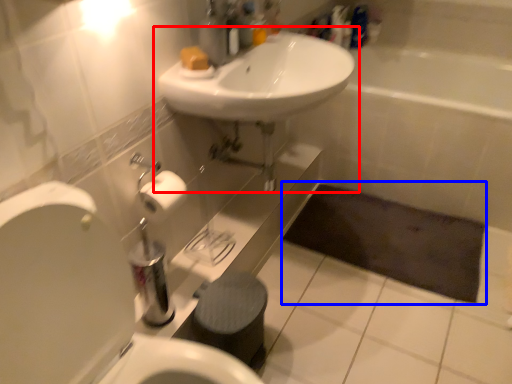
Question: Which point is further to the camera, sink (highlighted by a red box) or bath mat (highlighted by a blue box)?

Choices:
 (A) sink
 (B) bath mat

Answer: (B)